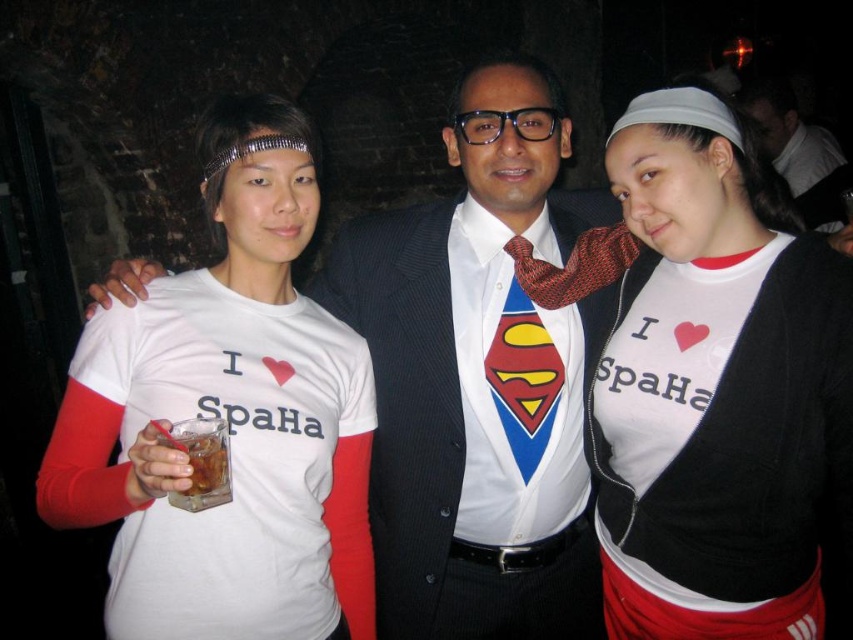
Question: Estimate the real-world distances between objects in this image. Which object is closer to the white fabric t-shirt at left?

Choices:
 (A) translucent glass drink at lower left
 (B) matte black suit at center
 (C) red textured tie at center

Answer: (A)

Question: Among these points, which one is farthest from the camera?

Choices:
 (A) (621, 253)
 (B) (813, 150)
 (C) (340, 440)

Answer: (B)

Question: Which object appears closest to the camera in this image?

Choices:
 (A) translucent glass drink at lower left
 (B) matte black suit at center

Answer: (A)

Question: Does white matte t-shirt at center come in front of white fabric t-shirt at left?

Choices:
 (A) no
 (B) yes

Answer: (A)

Question: Can you confirm if white fabric t-shirt at left is positioned to the left of red textured tie at center?

Choices:
 (A) yes
 (B) no

Answer: (A)

Question: Can you confirm if matte black suit at center is smaller than translucent glass drink at lower left?

Choices:
 (A) no
 (B) yes

Answer: (A)